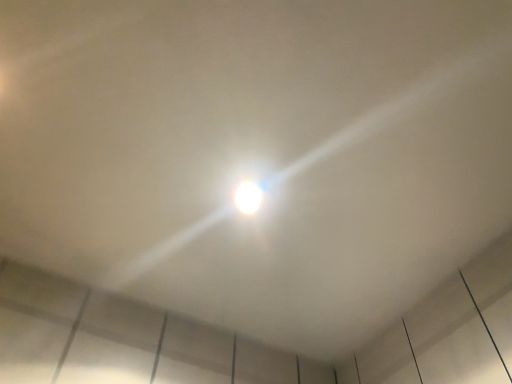
Where is `white glossy light bulb at center`? Image resolution: width=512 pixels, height=384 pixels. white glossy light bulb at center is located at coordinates (248, 197).

The width and height of the screenshot is (512, 384). Describe the element at coordinates (248, 197) in the screenshot. I see `white glossy light bulb at center` at that location.

In order to face white glossy light bulb at center, should I rotate leftwards or rightwards?

To face it directly, rotate left by 1.149 degrees.

Locate an element on the screen. The height and width of the screenshot is (384, 512). white glossy light bulb at center is located at coordinates (248, 197).